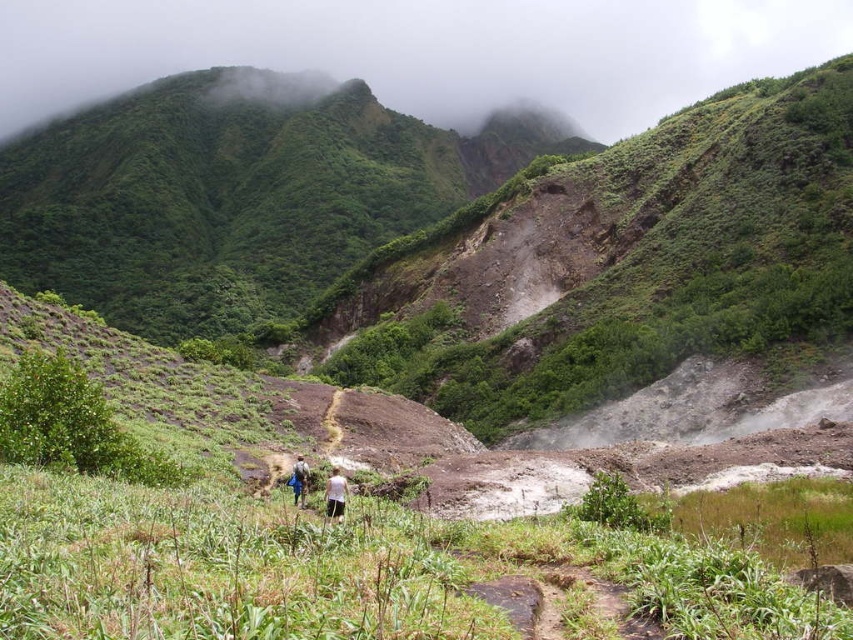
Which is in front, point (148, 99) or point (325, 490)?

Point (325, 490)

Is green grassy mountain at upper center wider than blue fabric couple at center?

Yes, green grassy mountain at upper center is wider than blue fabric couple at center.

What do you see at coordinates (236, 195) in the screenshot?
I see `green grassy mountain at upper center` at bounding box center [236, 195].

This screenshot has width=853, height=640. Find the location of `green grassy mountain at upper center`. green grassy mountain at upper center is located at coordinates (236, 195).

Can you confirm if blue fabric couple at center is positioned to the right of white fabric shirt at center?

Incorrect, blue fabric couple at center is not on the right side of white fabric shirt at center.

Between blue fabric couple at center and white fabric shirt at center, which one appears on the left side from the viewer's perspective?

blue fabric couple at center

Between point (334, 467) and point (329, 486), which one is positioned behind?

Point (334, 467)

I want to click on blue fabric couple at center, so click(x=335, y=493).

Can you confirm if green grassy mountain at upper center is positioned to the right of white fabric shirt at center?

In fact, green grassy mountain at upper center is to the left of white fabric shirt at center.

Can you confirm if green grassy mountain at upper center is taller than white fabric shirt at center?

Yes.

Between point (341, 168) and point (329, 500), which one is positioned in front?

Point (329, 500)

The width and height of the screenshot is (853, 640). I want to click on green grassy mountain at upper center, so click(x=236, y=195).